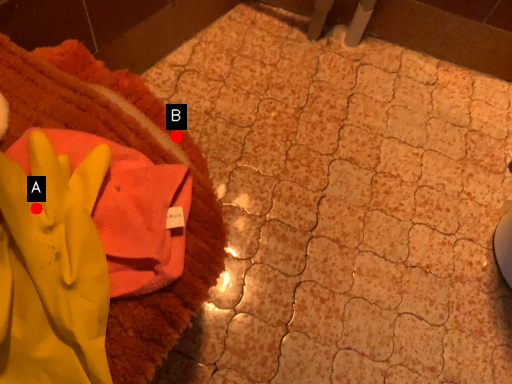
Question: Two points are circled on the image, labeled by A and B beside each circle. Which point is closer to the camera?

Choices:
 (A) A is closer
 (B) B is closer

Answer: (A)